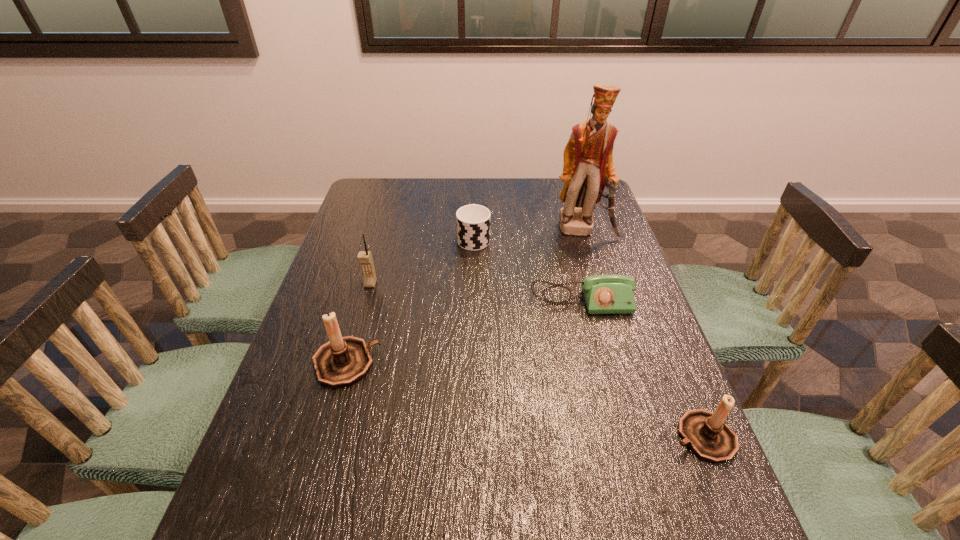
The image size is (960, 540). In order to click on candle holder that is positioned at the right edge in this screenshot , I will do tap(710, 438).

Find the location of a particular element. The image size is (960, 540). nutcracker positioned at the right edge is located at coordinates (588, 167).

At what (x,y) coordinates should I click in order to perform the action: click on telephone that is at the right edge. Please return your answer as a coordinate pair (x, y). Looking at the image, I should click on (604, 294).

You are a GUI agent. You are given a task and a screenshot of the screen. Output one action in this format:
    pyautogui.click(x=<x>, y=<y>)
    Task: Click on the object that is at the near right corner
    
    Given the screenshot: What is the action you would take?
    pyautogui.click(x=710, y=438)

Locate an element on the screen. vacant space at the far edge of the desktop is located at coordinates (519, 211).

The height and width of the screenshot is (540, 960). What are the coordinates of `free space at the left edge` in the screenshot? It's located at (319, 409).

The width and height of the screenshot is (960, 540). I want to click on vacant space at the right edge of the desktop, so click(x=604, y=364).

In the image, there is a desktop. What are the coordinates of `vacant space at the near left corner` in the screenshot? It's located at tap(252, 478).

This screenshot has width=960, height=540. I want to click on vacant space that is in between the cellular telephone and the shortest object, so click(476, 292).

The width and height of the screenshot is (960, 540). In order to click on unoccupied position between the tallest object and the fifth farthest object in this screenshot , I will do `click(465, 296)`.